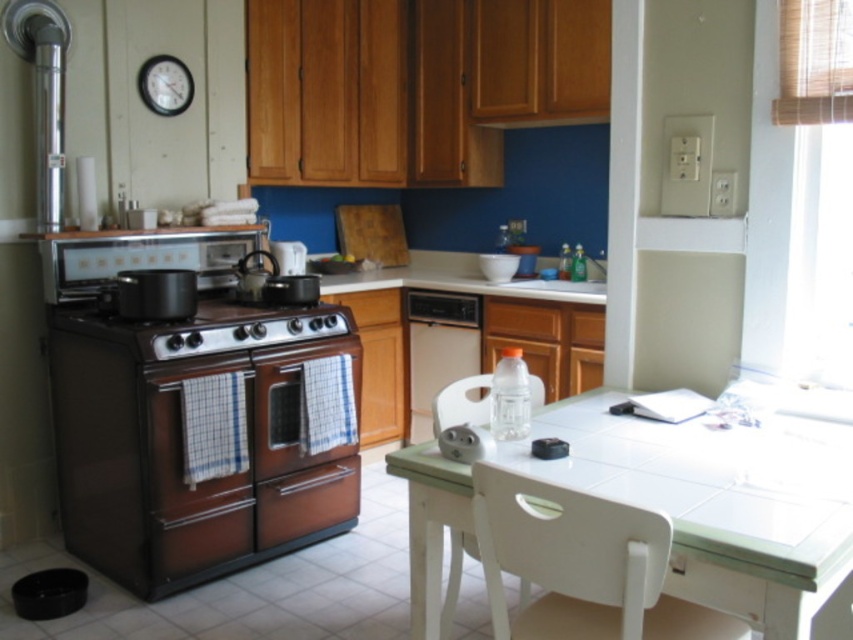
You are standing in the kitchen and want to place a small plant between the two points, point (x=480, y=301) and point (x=422, y=253). Which point should the plant be closer to in order to be closer to the stove?

The plant should be closer to point (x=480, y=301) because it is closer to the viewer than point (x=422, y=253), meaning it is physically nearer to the stove.